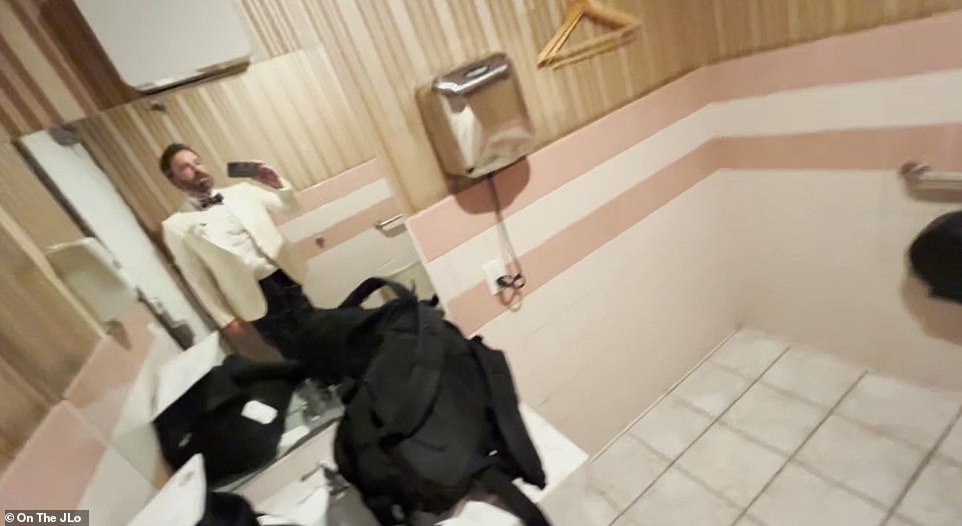
Locate an element on the screen. basuimirror is located at coordinates (398, 439), (211, 288), (284, 150).